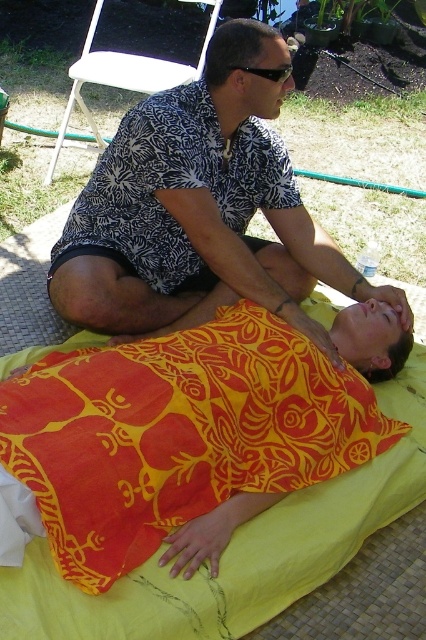
You are standing in the outdoor massage area and need to locate the printed fabric shirt at upper center. Based on the coordinates provided, where should you look relative to the center of the image?

The printed fabric shirt at upper center is located at coordinates 0.330 on the x axis and 0.472 on the y axis, which means it is positioned to the left and slightly above the center of the image.

You are a photographer taking a picture of the massage scene. You notice the printed fabric shirt at upper center and the black plastic sunglasses at upper center. Which object is located to the right of the other?

The printed fabric shirt at upper center is positioned on the right side of black plastic sunglasses at upper center.